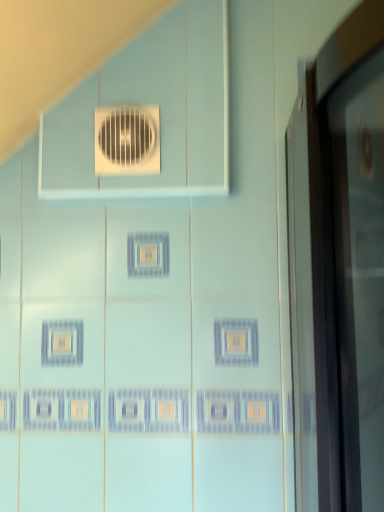
Locate an element on the screen. white plastic air conditioner at upper center is located at coordinates (127, 140).

What do you see at coordinates (127, 140) in the screenshot?
I see `white plastic air conditioner at upper center` at bounding box center [127, 140].

You are a GUI agent. You are given a task and a screenshot of the screen. Output one action in this format:
    pyautogui.click(x=<x>, y=<y>)
    Task: Click on the white plastic air conditioner at upper center
    Image resolution: width=384 pixels, height=512 pixels.
    Given the screenshot: What is the action you would take?
    pyautogui.click(x=127, y=140)